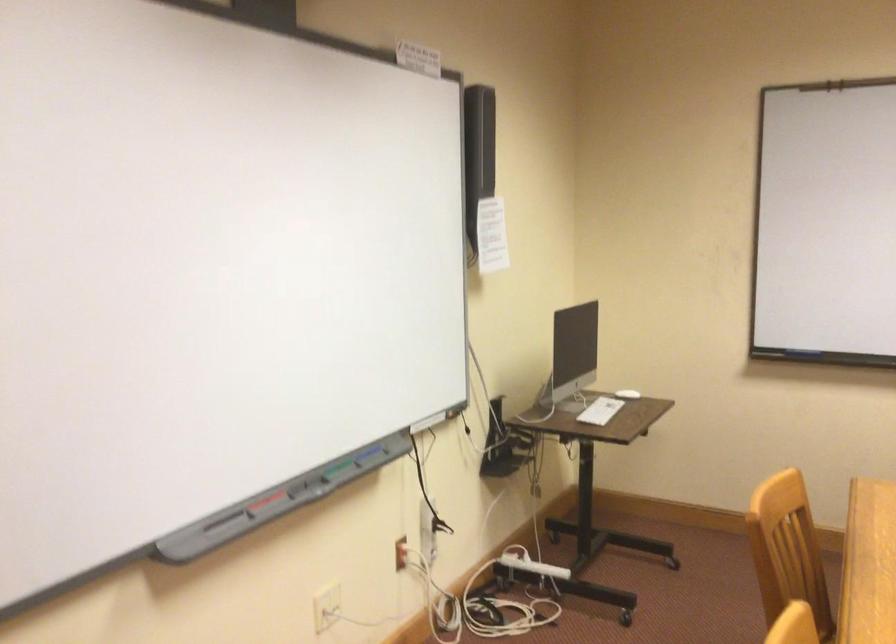
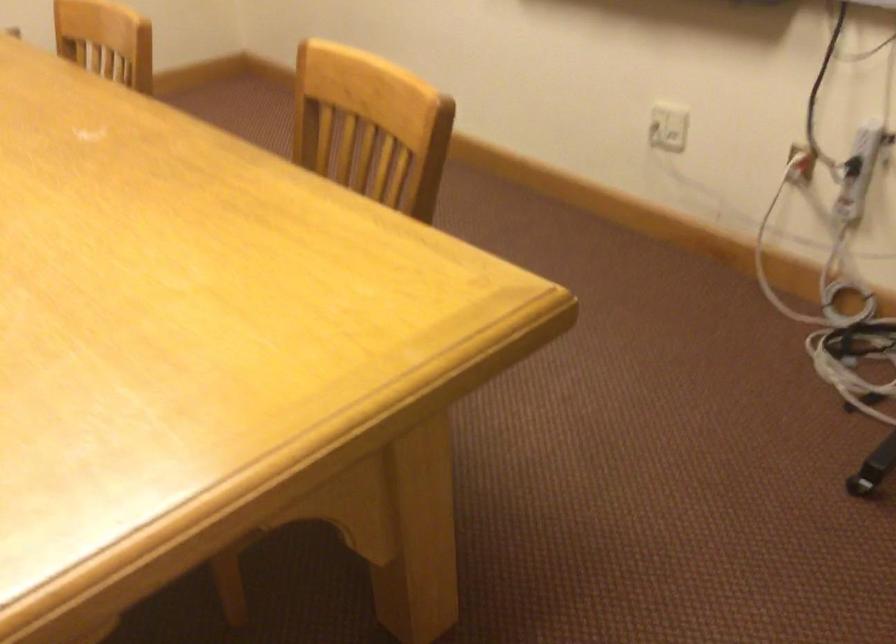
Locate, in the second image, the point that corresponds to (x=410, y=547) in the first image.

(800, 164)